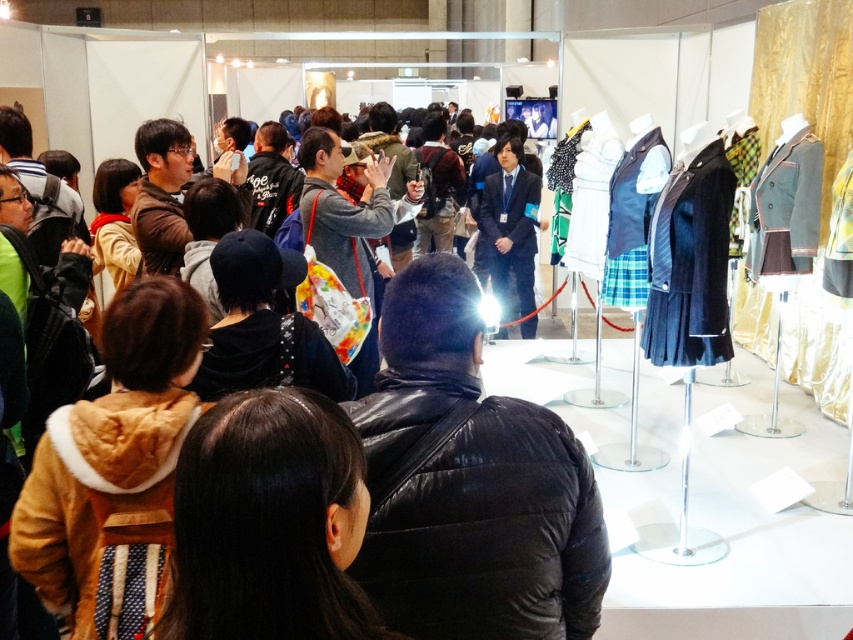
Question: Is black leather jacket at center smaller than brown fur coat at lower left?

Choices:
 (A) yes
 (B) no

Answer: (B)

Question: Which of the following is the farthest from the observer?

Choices:
 (A) black leather jacket at center
 (B) brown fur coat at lower left

Answer: (A)

Question: Which of the following is the closest to the observer?

Choices:
 (A) (376, 500)
 (B) (204, 593)

Answer: (B)

Question: Can you confirm if black leather jacket at center is wider than brown fur coat at lower left?

Choices:
 (A) no
 (B) yes

Answer: (B)

Question: Can you confirm if black leather jacket at center is wider than brown fur coat at lower left?

Choices:
 (A) no
 (B) yes

Answer: (B)